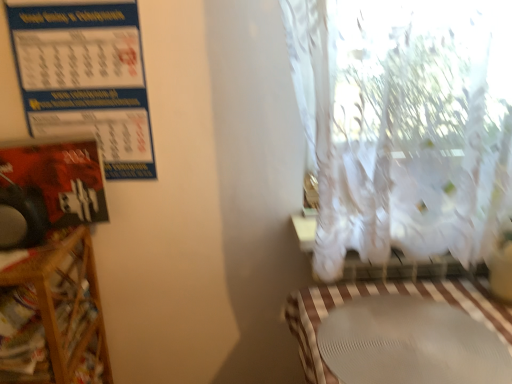
Where is `wooden shelf at left`? Image resolution: width=512 pixels, height=384 pixels. wooden shelf at left is located at coordinates (x=66, y=310).

What do you see at coordinates (85, 77) in the screenshot? Image resolution: width=512 pixels, height=384 pixels. I see `blue paper calendar at upper left` at bounding box center [85, 77].

At what (x,y) coordinates should I click in order to perform the action: click on wooden shelf at left. Please return your answer as a coordinate pair (x, y). This screenshot has width=512, height=384. Looking at the image, I should click on (66, 310).

Based on the photo, from a real-world perspective, relative to blue paper calendar at upper left, is wooden shelf at left vertically above or below?

In terms of real-world spatial position, wooden shelf at left is below blue paper calendar at upper left.

Considering the relative sizes of wooden shelf at left and blue paper calendar at upper left in the image provided, is wooden shelf at left shorter than blue paper calendar at upper left?

Incorrect, the height of wooden shelf at left does not fall short of that of blue paper calendar at upper left.

Is blue paper calendar at upper left inside wooden shelf at left?

No, blue paper calendar at upper left is not inside wooden shelf at left.

From the picture: Is white matte table at lower right situated inside blue paper calendar at upper left or outside?

white matte table at lower right cannot be found inside blue paper calendar at upper left.

Considering the relative sizes of white matte table at lower right and blue paper calendar at upper left in the image provided, is white matte table at lower right shorter than blue paper calendar at upper left?

Yes, white matte table at lower right is shorter than blue paper calendar at upper left.

Are white matte table at lower right and blue paper calendar at upper left located far from each other?

white matte table at lower right is near blue paper calendar at upper left, not far away.

Is point (486, 325) positioned behind point (110, 65)?

No, (486, 325) is in front of (110, 65).

Is point (37, 85) closer or farther from the camera than point (106, 375)?

Point (37, 85) is closer to the camera than point (106, 375).

Which object is further away from the camera, blue paper calendar at upper left or wooden shelf at left?

blue paper calendar at upper left is more distant.

Could you tell me if blue paper calendar at upper left is turned towards wooden shelf at left?

No, blue paper calendar at upper left is not aimed at wooden shelf at left.

Considering the positions of objects blue paper calendar at upper left and wooden shelf at left in the image provided, who is more to the right, blue paper calendar at upper left or wooden shelf at left?

blue paper calendar at upper left.

Could you tell me if wooden shelf at left is turned towards white matte table at lower right?

No, wooden shelf at left does not turn towards white matte table at lower right.

From a real-world perspective, between wooden shelf at left and white matte table at lower right, who is vertically higher?

In real-world perspective, white matte table at lower right is above.

Is wooden shelf at left surrounding white matte table at lower right?

No, wooden shelf at left does not contain white matte table at lower right.

Are wooden shelf at left and white matte table at lower right located far from each other?

No.

Which is closer, (337, 296) or (54, 361)?

Point (54, 361)

Which object is positioned more to the right, white matte table at lower right or wooden shelf at left?

From the viewer's perspective, white matte table at lower right appears more on the right side.

Choose the correct answer: Is white matte table at lower right inside wooden shelf at left or outside it?

The correct answer is: outside.

How many degrees apart are the facing directions of white matte table at lower right and wooden shelf at left?

white matte table at lower right and wooden shelf at left are facing 2.09 degrees away from each other.

Who is smaller, blue paper calendar at upper left or white matte table at lower right?

white matte table at lower right.

Is blue paper calendar at upper left positioned beyond the bounds of white matte table at lower right?

Result: Indeed, blue paper calendar at upper left is completely outside white matte table at lower right.

Is the position of blue paper calendar at upper left less distant than that of white matte table at lower right?

That is False.

You are a GUI agent. You are given a task and a screenshot of the screen. Output one action in this format:
    pyautogui.click(x=<x>, y=<y>)
    Task: Click on the furniture lying in front of the blue paper calendar at upper left
    The image size is (512, 384).
    Given the screenshot: What is the action you would take?
    pyautogui.click(x=66, y=310)

Locate an element on the screen. The height and width of the screenshot is (384, 512). calendar that is behind the white matte table at lower right is located at coordinates (85, 77).

Estimate the real-world distances between objects in this image. Which object is further from wooden shelf at left, white matte table at lower right or blue paper calendar at upper left?

white matte table at lower right.

In the scene shown: Estimate the real-world distances between objects in this image. Which object is closer to white matte table at lower right, wooden shelf at left or blue paper calendar at upper left?

wooden shelf at left is positioned closer to the anchor white matte table at lower right.

From the image, which object appears to be nearer to wooden shelf at left, blue paper calendar at upper left or white matte table at lower right?

blue paper calendar at upper left is positioned closer to the anchor wooden shelf at left.

Consider the image. Estimate the real-world distances between objects in this image. Which object is closer to blue paper calendar at upper left, wooden shelf at left or white matte table at lower right?

wooden shelf at left lies closer to blue paper calendar at upper left than the other object.

Considering their positions, is white matte table at lower right positioned further to blue paper calendar at upper left than wooden shelf at left?

white matte table at lower right.

Based on their spatial positions, is blue paper calendar at upper left or wooden shelf at left further from white matte table at lower right?

blue paper calendar at upper left is further to white matte table at lower right.

Find the location of `calendar between wooden shelf at left and white matte table at lower right in the horizontal direction`. calendar between wooden shelf at left and white matte table at lower right in the horizontal direction is located at coordinates [85, 77].